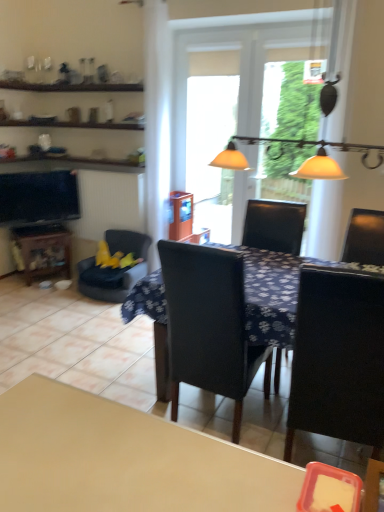
Question: Can you confirm if velvet yellow chair at left, which ranks as the first chair in left-to-right order, is smaller than dark blue fabric table at center?

Choices:
 (A) no
 (B) yes

Answer: (B)

Question: Considering the relative sizes of velvet yellow chair at left, placed as the third chair when sorted from front to back, and dark blue fabric table at center in the image provided, is velvet yellow chair at left, placed as the third chair when sorted from front to back, shorter than dark blue fabric table at center?

Choices:
 (A) yes
 (B) no

Answer: (A)

Question: Is velvet yellow chair at left, placed as the third chair when sorted from front to back, bigger than dark blue fabric table at center?

Choices:
 (A) yes
 (B) no

Answer: (B)

Question: Considering the relative positions of velvet yellow chair at left, the first chair when ordered from back to front, and dark blue fabric table at center in the image provided, is velvet yellow chair at left, the first chair when ordered from back to front, to the right of dark blue fabric table at center from the viewer's perspective?

Choices:
 (A) no
 (B) yes

Answer: (A)

Question: Is velvet yellow chair at left, placed as the third chair when sorted from front to back, positioned far away from dark blue fabric table at center?

Choices:
 (A) no
 (B) yes

Answer: (B)

Question: From the image's perspective, is translucent plastic screen door at center above or below dark blue fabric table at center?

Choices:
 (A) below
 (B) above

Answer: (B)

Question: Looking at their shapes, would you say translucent plastic screen door at center is wider or thinner than dark blue fabric table at center?

Choices:
 (A) thin
 (B) wide

Answer: (A)

Question: Does point (178, 50) appear closer or farther from the camera than point (379, 254)?

Choices:
 (A) farther
 (B) closer

Answer: (A)

Question: Looking at the image, does translucent plastic screen door at center seem bigger or smaller compared to dark blue fabric table at center?

Choices:
 (A) small
 (B) big

Answer: (A)

Question: From a real-world perspective, is velvet yellow chair at left, the first chair when ordered from back to front, positioned above or below black leather chair at center, marked as the 2th chair in a back-to-front arrangement?

Choices:
 (A) below
 (B) above

Answer: (A)

Question: In terms of width, does velvet yellow chair at left, which ranks as the first chair in left-to-right order, look wider or thinner when compared to black leather chair at center, which appears as the second chair when viewed from the right?

Choices:
 (A) thin
 (B) wide

Answer: (A)

Question: Is velvet yellow chair at left, placed as the third chair when sorted from front to back, in front of or behind black leather chair at center, which appears as the second chair when viewed from the right, in the image?

Choices:
 (A) behind
 (B) front

Answer: (A)

Question: From the image's perspective, is velvet yellow chair at left, the first chair when ordered from back to front, located above or below black leather chair at center, which is the 2th chair in left-to-right order?

Choices:
 (A) below
 (B) above

Answer: (B)

Question: From a real-world perspective, is black leather chair at center, marked as the 2th chair in a back-to-front arrangement, positioned above or below matte glass light fixture at upper center?

Choices:
 (A) above
 (B) below

Answer: (B)

Question: Is black leather chair at center, marked as the 2th chair in a back-to-front arrangement, inside the boundaries of matte glass light fixture at upper center, or outside?

Choices:
 (A) outside
 (B) inside

Answer: (A)